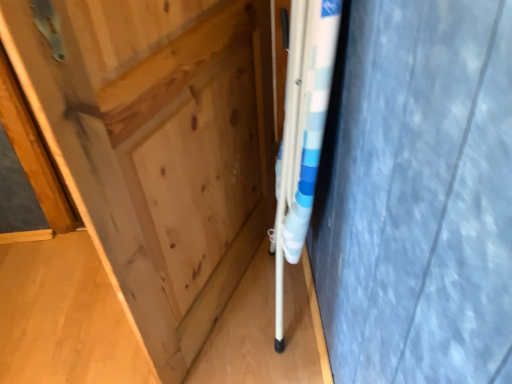
Question: Should I look upward or downward to see white plastic crutch at center?

Choices:
 (A) up
 (B) down

Answer: (A)